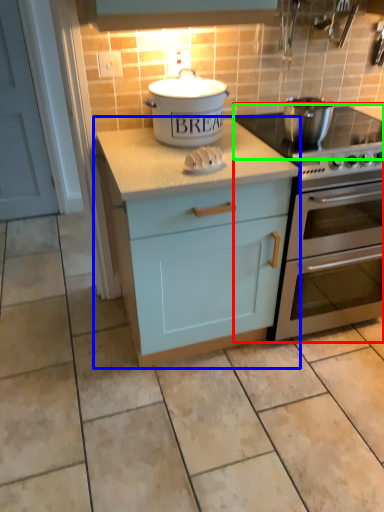
Question: Based on their relative distances, which object is nearer to oven (highlighted by a red box)? Choose from cabinetry (highlighted by a blue box) and gas stove (highlighted by a green box).

Choices:
 (A) cabinetry
 (B) gas stove

Answer: (A)